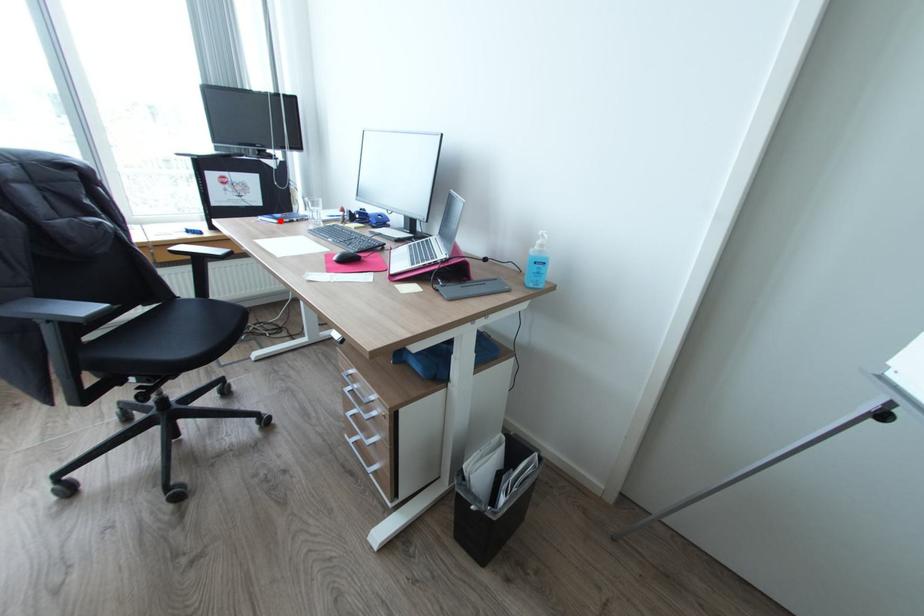
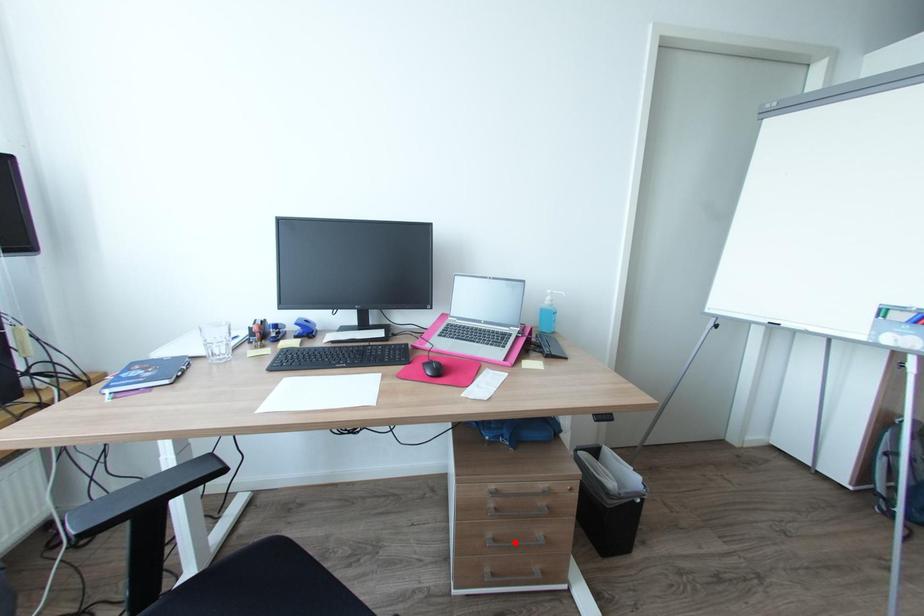
I am providing you with two images of the same scene from different viewpoints. A red point is marked on the first image and another point is marked on the second image. Are the points marked in image1 and image2 representing the same 3D position?

No